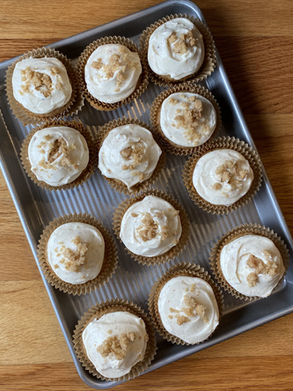
At what (x,y) coordinates should I click in order to perform the action: click on table surface. Please return your answer as a coordinate pair (x, y). The image size is (293, 391). Looking at the image, I should click on (245, 365).